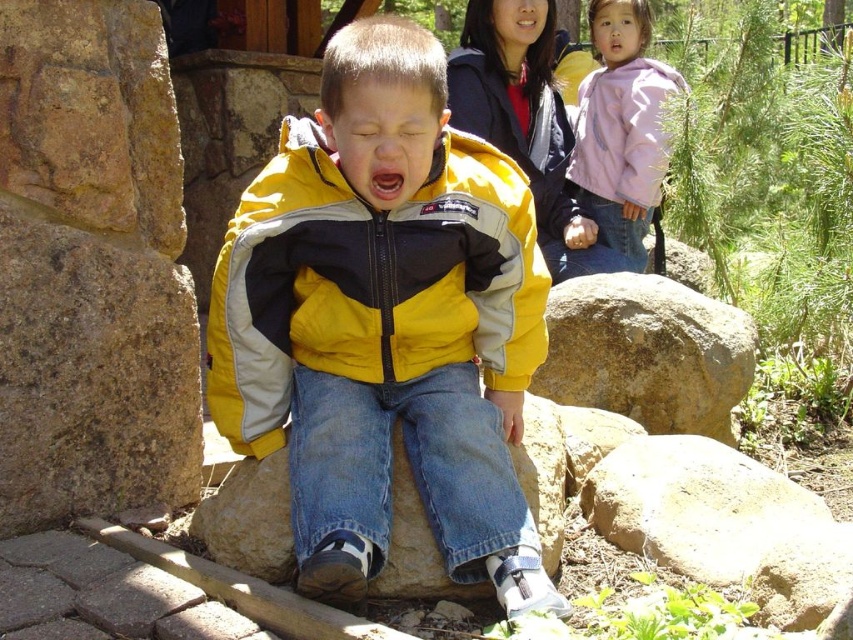
Question: Among these points, which one is farthest from the camera?

Choices:
 (A) (80, 483)
 (B) (357, 189)
 (C) (598, 120)

Answer: (C)

Question: Does pastel pink fleece at upper right come behind light purple fleece jacket at upper right?

Choices:
 (A) yes
 (B) no

Answer: (A)

Question: Does yellow matte jacket at center come behind open yellow mouth at center?

Choices:
 (A) no
 (B) yes

Answer: (A)

Question: Is the position of brown rough stone at left less distant than that of rocky brown boulder at right?

Choices:
 (A) no
 (B) yes

Answer: (B)

Question: Which of the following is the farthest from the observer?

Choices:
 (A) (85, 346)
 (B) (360, 49)
 (C) (373, 195)

Answer: (A)

Question: Which point appears farthest from the camera in this image?

Choices:
 (A) (647, 406)
 (B) (456, 115)
 (C) (270, 448)

Answer: (B)